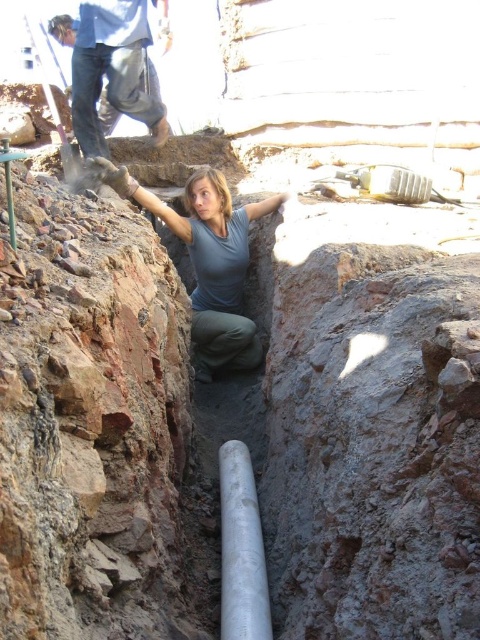
Question: Is matte gray shirt at center positioned before blue jeans at upper left?

Choices:
 (A) no
 (B) yes

Answer: (B)

Question: Which object is farther from the camera taking this photo?

Choices:
 (A) blue jeans at upper left
 (B) silver metallic pipe at center
 (C) matte gray shirt at center

Answer: (A)

Question: Based on their relative distances, which object is nearer to the silver metallic pipe at center?

Choices:
 (A) matte gray shirt at center
 (B) blue jeans at upper left

Answer: (A)

Question: Observing the image, what is the correct spatial positioning of blue jeans at upper left in reference to silver metallic pipe at center?

Choices:
 (A) above
 (B) below

Answer: (A)

Question: Among these points, which one is farthest from the camera?

Choices:
 (A) pyautogui.click(x=196, y=365)
 (B) pyautogui.click(x=242, y=573)

Answer: (A)

Question: Does matte gray shirt at center appear over silver metallic pipe at center?

Choices:
 (A) yes
 (B) no

Answer: (A)